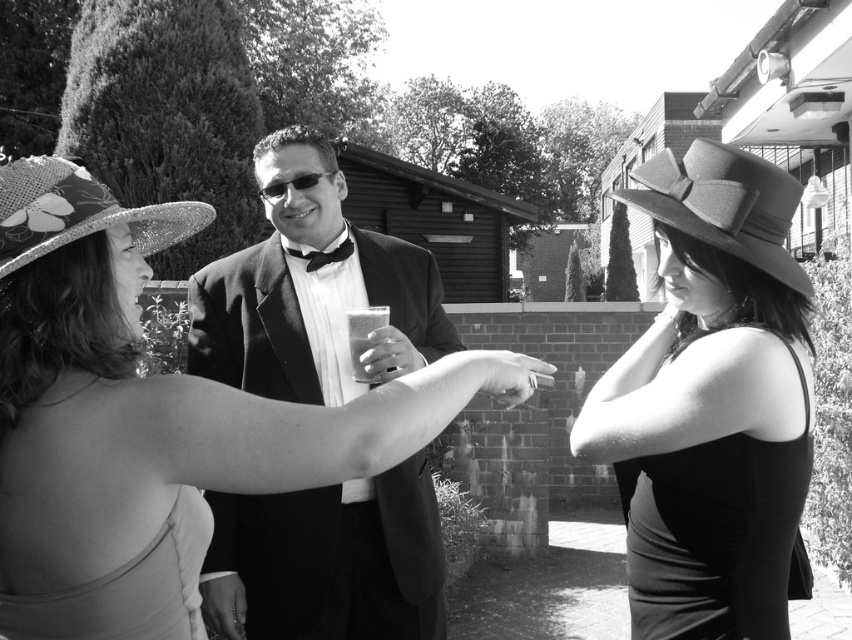
Question: Considering the relative positions of matte black hat at right and black satin bow tie at center in the image provided, where is matte black hat at right located with respect to black satin bow tie at center?

Choices:
 (A) above
 (B) below

Answer: (A)

Question: Can you confirm if shiny fabric hat at center is positioned to the left of matte black hat at center?

Choices:
 (A) no
 (B) yes

Answer: (B)

Question: Which object is positioned farthest from the matte black hat at center?

Choices:
 (A) shiny black suit at center
 (B) black satin bow tie at center
 (C) matte black hat at right

Answer: (B)

Question: Which of these objects is positioned farthest from the shiny black suit at center?

Choices:
 (A) matte black hat at center
 (B) matte black hat at right
 (C) black satin bow tie at center
 (D) floral-patterned straw hat at left

Answer: (A)

Question: Estimate the real-world distances between objects in this image. Which object is farther from the translucent glass at center?

Choices:
 (A) black satin bow tie at center
 (B) shiny black suit at center
 (C) matte black hat at right
 (D) floral-patterned straw hat at left

Answer: (C)

Question: Does floral-patterned straw hat at left come behind black satin bow tie at center?

Choices:
 (A) yes
 (B) no

Answer: (B)